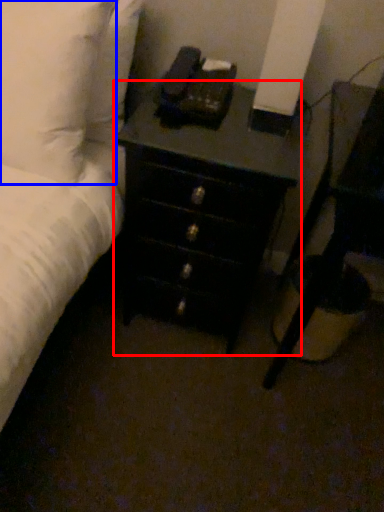
Question: Which point is closer to the camera, chest of drawers (highlighted by a red box) or pillow (highlighted by a blue box)?

Choices:
 (A) chest of drawers
 (B) pillow

Answer: (B)